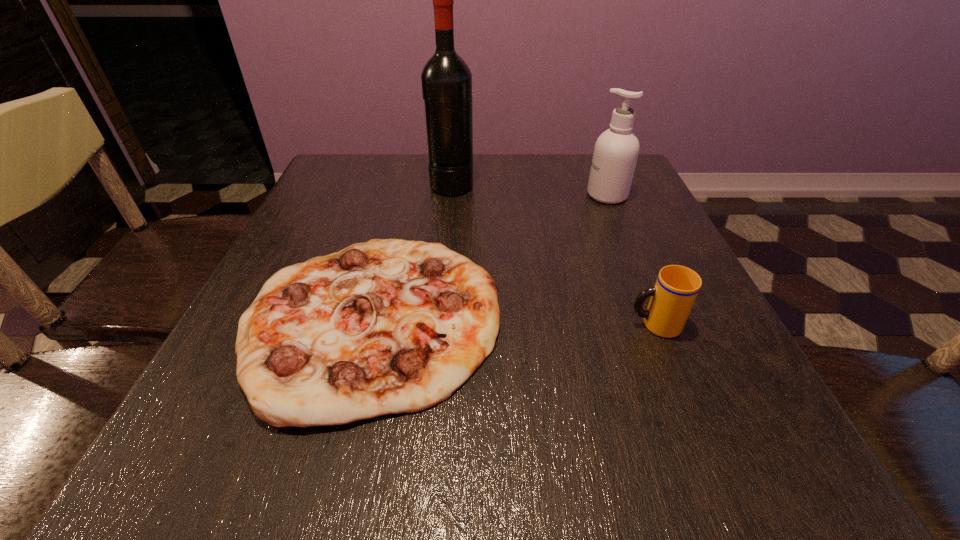
Image resolution: width=960 pixels, height=540 pixels. I want to click on vacant space located on the side of the cup with the handle, so click(556, 325).

Locate an element on the screen. This screenshot has width=960, height=540. free space located on the back of the shortest object is located at coordinates (410, 168).

At what (x,y) coordinates should I click in order to perform the action: click on wine bottle at the far edge. Please return your answer as a coordinate pair (x, y). Looking at the image, I should click on (446, 79).

This screenshot has height=540, width=960. In order to click on cleansing agent located in the far edge section of the desktop in this screenshot , I will do `click(616, 151)`.

In order to click on object positioned at the near edge in this screenshot , I will do `click(389, 326)`.

I want to click on object at the left edge, so click(389, 326).

The height and width of the screenshot is (540, 960). Find the location of `cleansing agent at the right edge`. cleansing agent at the right edge is located at coordinates (616, 151).

Identify the location of cup at the right edge. (672, 298).

Locate an element on the screen. The width and height of the screenshot is (960, 540). object at the near left corner is located at coordinates (389, 326).

You are a GUI agent. You are given a task and a screenshot of the screen. Output one action in this format:
    pyautogui.click(x=<x>, y=<y>)
    Task: Click on the object at the far right corner
    The height and width of the screenshot is (540, 960).
    Given the screenshot: What is the action you would take?
    pyautogui.click(x=616, y=151)